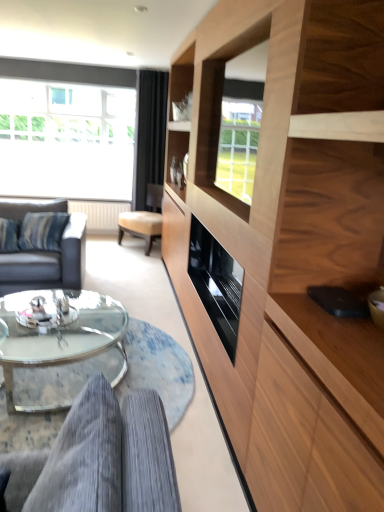
Question: Is black velvet curtain at upper center far from gray corduroy couch at lower left, arranged as the 2th studio couch when viewed from the left?

Choices:
 (A) yes
 (B) no

Answer: (A)

Question: Is black velvet curtain at upper center to the left of gray corduroy couch at lower left, arranged as the 2th studio couch when viewed from the back, from the viewer's perspective?

Choices:
 (A) yes
 (B) no

Answer: (A)

Question: Can you confirm if black velvet curtain at upper center is smaller than gray corduroy couch at lower left, the first studio couch in the front-to-back sequence?

Choices:
 (A) yes
 (B) no

Answer: (B)

Question: Considering the relative sizes of black velvet curtain at upper center and gray corduroy couch at lower left, which ranks as the 2th studio couch in top-to-bottom order, in the image provided, is black velvet curtain at upper center wider than gray corduroy couch at lower left, which ranks as the 2th studio couch in top-to-bottom order,?

Choices:
 (A) yes
 (B) no

Answer: (B)

Question: From a real-world perspective, is black velvet curtain at upper center located higher than gray corduroy couch at lower left, the first studio couch positioned from the right?

Choices:
 (A) yes
 (B) no

Answer: (A)

Question: Is point (46, 354) closer or farther from the camera than point (29, 280)?

Choices:
 (A) closer
 (B) farther

Answer: (A)

Question: Is clear glass coffee table at lower center inside or outside of dark gray leather couch at left, which is counted as the 2th studio couch, starting from the right?

Choices:
 (A) inside
 (B) outside

Answer: (B)

Question: Based on their sizes in the image, would you say clear glass coffee table at lower center is bigger or smaller than dark gray leather couch at left, which is counted as the 2th studio couch, starting from the right?

Choices:
 (A) big
 (B) small

Answer: (B)

Question: From the image's perspective, is clear glass coffee table at lower center positioned above or below dark gray leather couch at left, which is counted as the 2th studio couch, starting from the right?

Choices:
 (A) below
 (B) above

Answer: (A)

Question: In terms of height, does clear glass coffee table at lower center look taller or shorter compared to transparent glass window at upper left?

Choices:
 (A) short
 (B) tall

Answer: (A)

Question: Which is correct: clear glass coffee table at lower center is inside transparent glass window at upper left, or outside of it?

Choices:
 (A) inside
 (B) outside

Answer: (B)

Question: From a real-world perspective, is clear glass coffee table at lower center above or below transparent glass window at upper left?

Choices:
 (A) below
 (B) above

Answer: (A)

Question: In terms of size, does clear glass coffee table at lower center appear bigger or smaller than transparent glass window at upper left?

Choices:
 (A) big
 (B) small

Answer: (B)

Question: Looking at their shapes, would you say gray corduroy couch at lower left, the first studio couch in the front-to-back sequence, is wider or thinner than transparent glass window at upper left?

Choices:
 (A) thin
 (B) wide

Answer: (B)

Question: In terms of height, does gray corduroy couch at lower left, the first studio couch in the bottom-to-top sequence, look taller or shorter compared to transparent glass window at upper left?

Choices:
 (A) tall
 (B) short

Answer: (B)